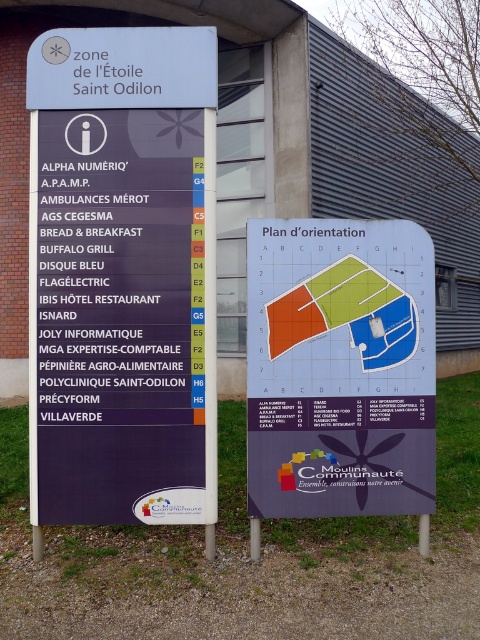
Question: Which object is positioned closest to the metallic pole at center?

Choices:
 (A) purple paper map at center
 (B) purple matte signboard at upper left

Answer: (A)

Question: Estimate the real-world distances between objects in this image. Which object is closer to the purple paper map at center?

Choices:
 (A) purple matte signboard at upper left
 (B) metallic pole at center

Answer: (A)

Question: Is purple matte signboard at upper left bigger than metallic pole at center?

Choices:
 (A) no
 (B) yes

Answer: (B)

Question: Does purple matte signboard at upper left have a lesser width compared to metallic pole at center?

Choices:
 (A) yes
 (B) no

Answer: (B)

Question: Can you confirm if purple matte signboard at upper left is positioned to the left of metallic pole at center?

Choices:
 (A) no
 (B) yes

Answer: (B)

Question: Which object is closer to the camera taking this photo?

Choices:
 (A) purple paper map at center
 (B) metallic pole at center
 (C) purple matte signboard at upper left

Answer: (C)